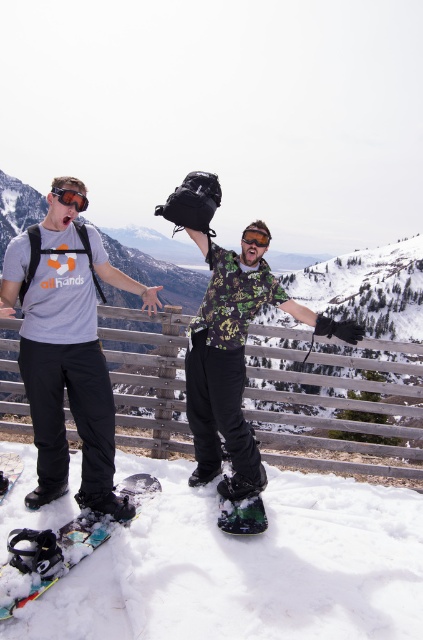
You are planning to carry both the green matte snowshoe at center and the white matte snowboard at lower left in a backpack. Which item should you place first to ensure they both fit?

The white matte snowboard at lower left should be placed first because it is narrower than the green matte snowshoe at center, allowing more space for the wider snowshoe afterward.

You are planning to take a photo of the two people on the snowy mountain top. You want to ensure both the matte black snowboard at center and the green matte snowshoe at center are clearly visible in the frame. Which object should be positioned to the right side of the other to achieve this?

The matte black snowboard at center is to the left of the green matte snowshoe at center, so to have both clearly visible, position the green matte snowshoe at center to the right side of the matte black snowboard at center.

You are a photographer trying to capture the best angle of the two points in the scene. Which point, point [35,275] or point [71,522], is closer to your camera position?

Point [35,275] is closer to the camera because it is further to the viewer than point [71,522].